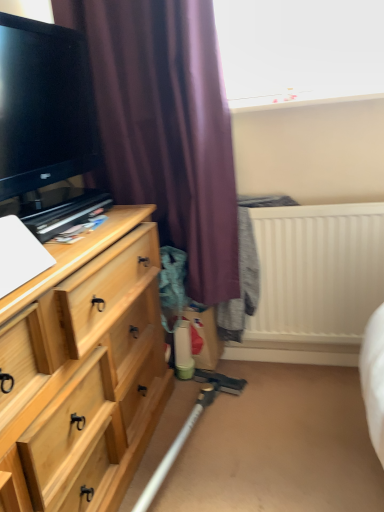
Question: Can you confirm if white plastic radiator at upper right is positioned to the left of light wood chest of drawers at left?

Choices:
 (A) no
 (B) yes

Answer: (A)

Question: Can you confirm if white plastic radiator at upper right is thinner than light wood chest of drawers at left?

Choices:
 (A) yes
 (B) no

Answer: (A)

Question: Is white plastic radiator at upper right oriented towards light wood chest of drawers at left?

Choices:
 (A) no
 (B) yes

Answer: (A)

Question: From a real-world perspective, is white plastic radiator at upper right located beneath light wood chest of drawers at left?

Choices:
 (A) no
 (B) yes

Answer: (A)

Question: From a real-world perspective, is white plastic radiator at upper right positioned over light wood chest of drawers at left based on gravity?

Choices:
 (A) no
 (B) yes

Answer: (B)

Question: Is point (127, 181) closer or farther from the camera than point (266, 269)?

Choices:
 (A) farther
 (B) closer

Answer: (A)

Question: Is purple matte curtain at upper left wider or thinner than white plastic radiator at upper right?

Choices:
 (A) wide
 (B) thin

Answer: (A)

Question: In terms of size, does purple matte curtain at upper left appear bigger or smaller than white plastic radiator at upper right?

Choices:
 (A) big
 (B) small

Answer: (A)

Question: Is purple matte curtain at upper left taller or shorter than white plastic radiator at upper right?

Choices:
 (A) short
 (B) tall

Answer: (B)

Question: Considering the positions of white plastic radiator at upper right and light wood chest of drawers at left in the image, is white plastic radiator at upper right taller or shorter than light wood chest of drawers at left?

Choices:
 (A) short
 (B) tall

Answer: (A)

Question: Considering the positions of white plastic radiator at upper right and light wood chest of drawers at left in the image, is white plastic radiator at upper right wider or thinner than light wood chest of drawers at left?

Choices:
 (A) thin
 (B) wide

Answer: (A)

Question: From a real-world perspective, is white plastic radiator at upper right above or below light wood chest of drawers at left?

Choices:
 (A) above
 (B) below

Answer: (A)

Question: In the image, is white plastic radiator at upper right positioned in front of or behind light wood chest of drawers at left?

Choices:
 (A) behind
 (B) front

Answer: (A)

Question: Is black glossy tv at left bigger or smaller than purple matte curtain at upper left?

Choices:
 (A) big
 (B) small

Answer: (B)

Question: Considering the positions of black glossy tv at left and purple matte curtain at upper left in the image, is black glossy tv at left taller or shorter than purple matte curtain at upper left?

Choices:
 (A) tall
 (B) short

Answer: (B)